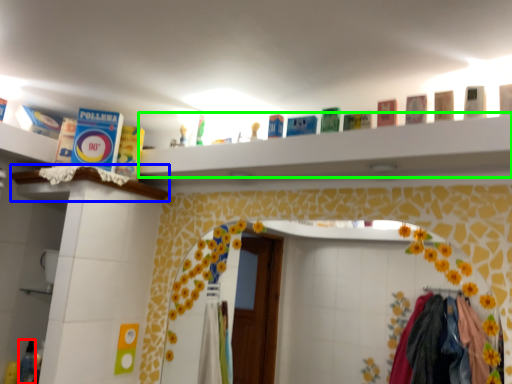
Question: Which object is the farthest from toiletry (highlighted by a red box)? Choose among these: ledge (highlighted by a blue box) or ledge (highlighted by a green box).

Choices:
 (A) ledge
 (B) ledge

Answer: (B)